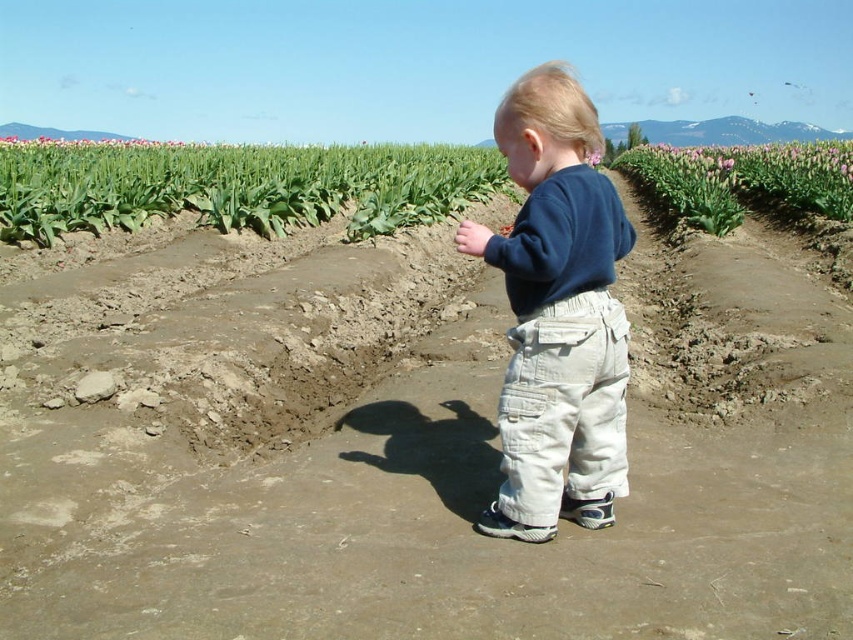
You are a gardener who needs to walk from the brown muddy path at center to the green leafy corn field at upper left. Which path is narrower and requires more careful walking?

The brown muddy path at center has a lesser width compared to the green leafy corn field at upper left, so it requires more careful walking due to its narrower width.

You are a farmer planning to plant a new row of crops. You have a tractor that can only move along the width of the green leafy corn field at upper left. If you want to plant a row in the pink tulip field at right, will your tractor be able to move across its width?

The green leafy corn field at upper left might be wider than the pink tulip field at right. Since the tractor can only move along the width of the corn field, it may be wider than needed for the tulip field. Therefore, the tractor should be able to move across the width of the pink tulip field at right.

You are a farmer checking the crops in the field. You see the brown muddy path at center and the green leafy corn field at upper left. Which one is closer to you?

The brown muddy path at center is closer to you because it is shorter than the green leafy corn field at upper left.